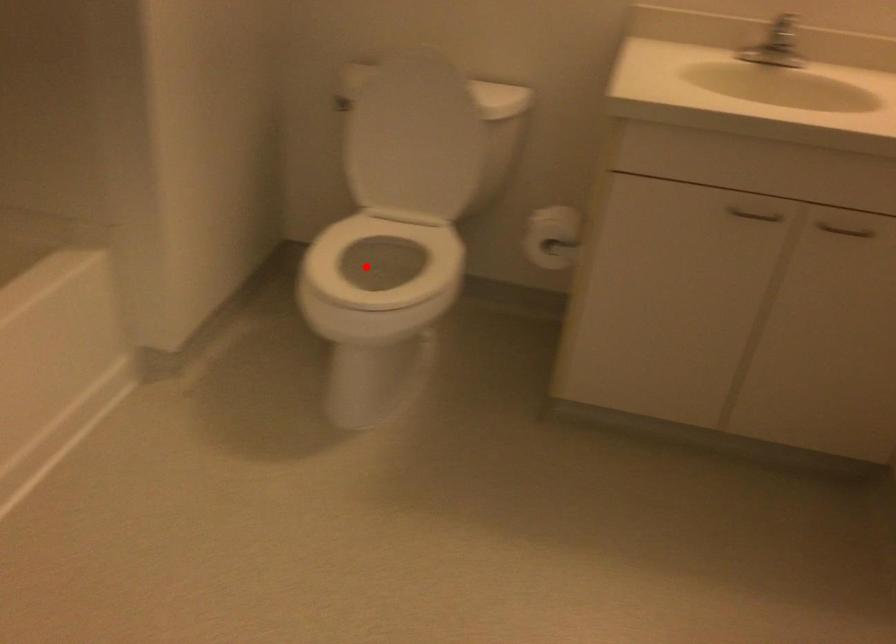
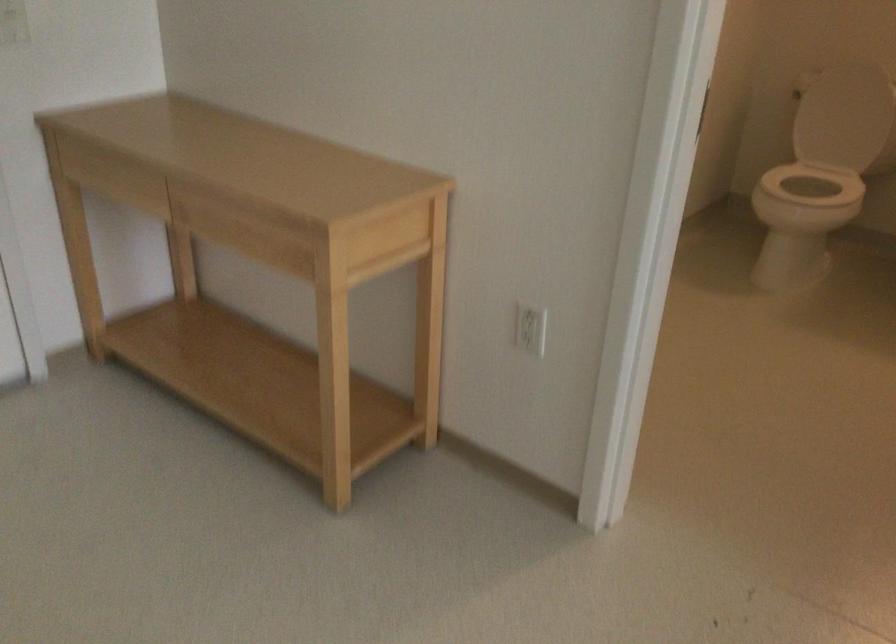
Find the pixel in the second image that matches the highlighted location in the first image.

(814, 184)